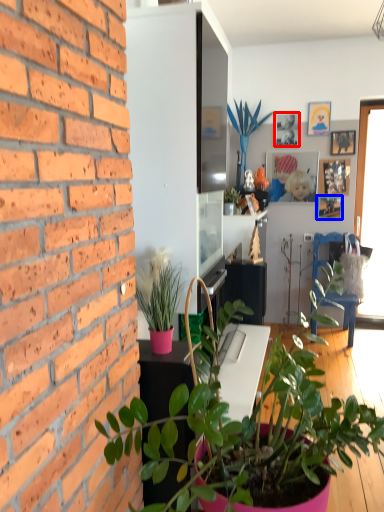
Question: Which object appears farthest to the camera in this image, picture frame (highlighted by a red box) or picture frame (highlighted by a blue box)?

Choices:
 (A) picture frame
 (B) picture frame

Answer: (B)